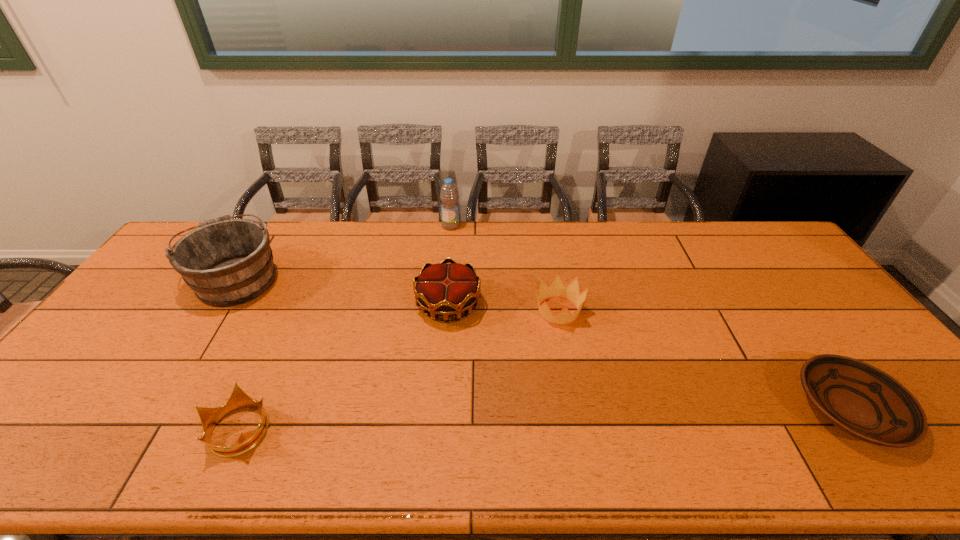
Where is `vacant position in the image that satisfies the following two spatial constraints: 1. on the front side of the leftmost object; 2. on the right side of the plate`? The width and height of the screenshot is (960, 540). vacant position in the image that satisfies the following two spatial constraints: 1. on the front side of the leftmost object; 2. on the right side of the plate is located at coordinates tap(154, 409).

This screenshot has width=960, height=540. I want to click on free space that satisfies the following two spatial constraints: 1. on the back side of the farthest object; 2. on the right side of the wine bucket, so click(270, 226).

You are a GUI agent. You are given a task and a screenshot of the screen. Output one action in this format:
    pyautogui.click(x=<x>, y=<y>)
    Task: Click on the vacant region that satisfies the following two spatial constraints: 1. on the front side of the second crown from left to right; 2. on the right side of the water bottle
    
    Given the screenshot: What is the action you would take?
    pyautogui.click(x=444, y=305)

This screenshot has width=960, height=540. Identify the location of vacant space that satisfies the following two spatial constraints: 1. on the front side of the rightmost crown; 2. on the left side of the rightmost object. (577, 409).